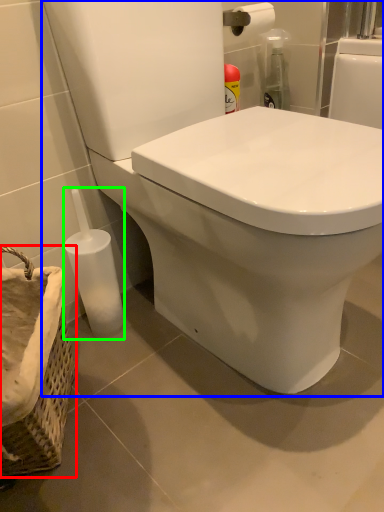
Question: Which object is the closest to the basket container (highlighted by a red box)? Choose among these: toilet (highlighted by a blue box) or bottle (highlighted by a green box).

Choices:
 (A) toilet
 (B) bottle

Answer: (B)